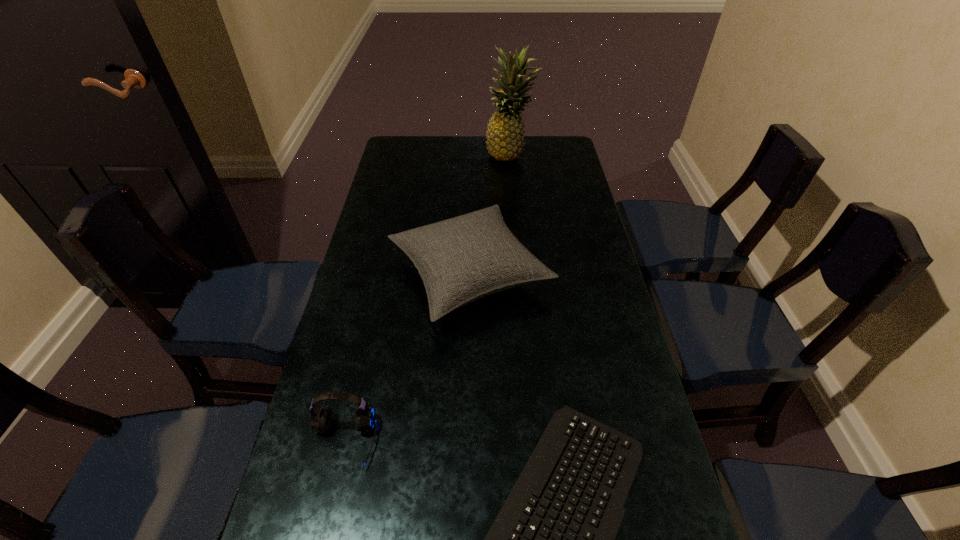
I want to click on the farthest object, so click(x=505, y=137).

Locate an element on the screen. The height and width of the screenshot is (540, 960). the tallest object is located at coordinates (505, 137).

At what (x,y) coordinates should I click in order to perform the action: click on cushion. Please return your answer as a coordinate pair (x, y). The image size is (960, 540). Looking at the image, I should click on (460, 260).

Find the location of `the second tallest object`. the second tallest object is located at coordinates (460, 260).

Find the location of a particular element. headset is located at coordinates (321, 416).

Identify the location of vacant area situated 0.210m on the front of the pineapple. The width and height of the screenshot is (960, 540). (514, 200).

Locate an element on the screen. The image size is (960, 540). free region located 0.070m on the right of the cushion is located at coordinates (576, 275).

At what (x,y) coordinates should I click in order to perform the action: click on vacant space situated 0.120m on the ear cushions of the second shortest object. Please return your answer as a coordinate pair (x, y). This screenshot has height=540, width=960. Looking at the image, I should click on (322, 539).

Identify the location of object present at the far edge. The image size is (960, 540). [x=505, y=137].

Find the location of a particular element. This screenshot has width=960, height=540. cushion that is at the left edge is located at coordinates (460, 260).